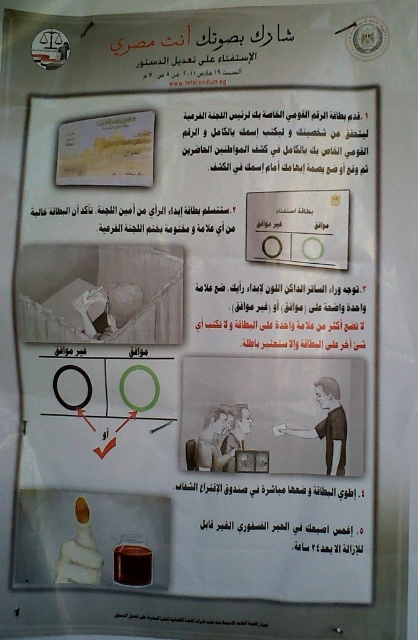
Does point (167, 38) come in front of point (310, 508)?

No, it is behind (310, 508).

Can you confirm if white paper at upper center is thinner than black paper at lower center?

No, white paper at upper center is not thinner than black paper at lower center.

Image resolution: width=418 pixels, height=640 pixels. I want to click on white paper at upper center, so click(196, 51).

Locate an element on the screen. white paper at upper center is located at coordinates (196, 51).

Between black paper at center and white paper at upper center, which one is positioned higher?

white paper at upper center

Which is below, black paper at center or white paper at upper center?

black paper at center is lower down.

Does point (257, 346) lie in front of point (239, 33)?

Yes, it is.

The image size is (418, 640). I want to click on black paper at center, so click(x=287, y=314).

Can you confirm if white paper at upper center is positioned above black paper at upper left?

Correct, white paper at upper center is located above black paper at upper left.

Does white paper at upper center have a smaller size compared to black paper at upper left?

Actually, white paper at upper center might be larger than black paper at upper left.

The height and width of the screenshot is (640, 418). In order to click on white paper at upper center in this screenshot , I will do `click(196, 51)`.

Locate an element on the screen. white paper at upper center is located at coordinates (196, 51).